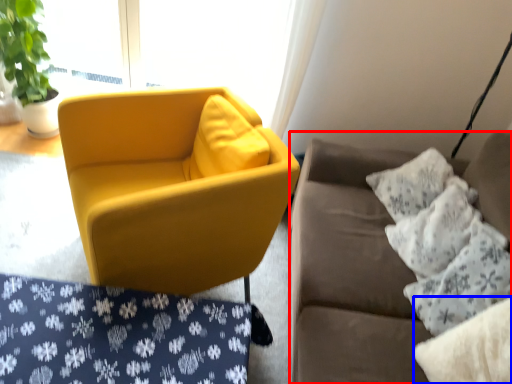
Question: Which object is closer to the camera taking this photo, studio couch (highlighted by a red box) or pillow (highlighted by a blue box)?

Choices:
 (A) studio couch
 (B) pillow

Answer: (A)